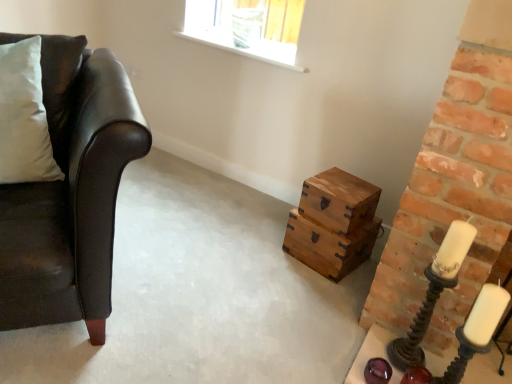
This screenshot has width=512, height=384. I want to click on free space that is to the left of wooden chest at center-right, so click(264, 248).